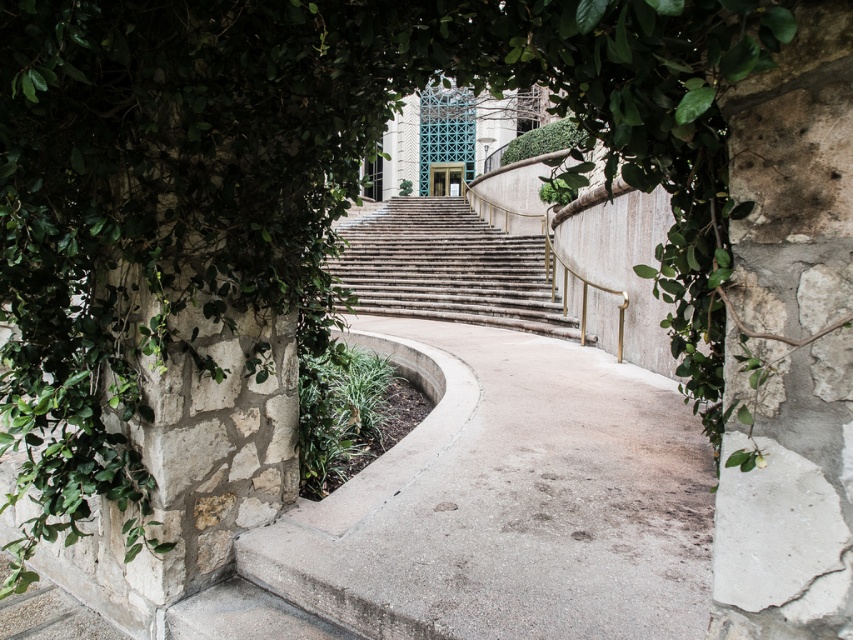
Question: Which point is closer to the camera?

Choices:
 (A) stone textured stairs at center
 (B) gray concrete path at lower center

Answer: (B)

Question: Can you confirm if gray concrete path at lower center is wider than stone textured stairs at center?

Choices:
 (A) no
 (B) yes

Answer: (A)

Question: Which point is farther to the camera?

Choices:
 (A) (531, 244)
 (B) (383, 540)

Answer: (A)

Question: Observing the image, what is the correct spatial positioning of gray concrete path at lower center in reference to stone textured stairs at center?

Choices:
 (A) right
 (B) left

Answer: (A)

Question: Among these objects, which one is nearest to the camera?

Choices:
 (A) stone textured stairs at center
 (B) gray concrete path at lower center

Answer: (B)

Question: Does gray concrete path at lower center have a larger size compared to stone textured stairs at center?

Choices:
 (A) no
 (B) yes

Answer: (A)